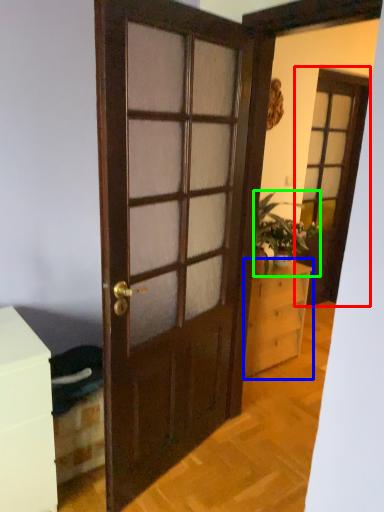
Question: Which is nearer to the screen door (highlighted by a red box)? chest of drawers (highlighted by a blue box) or houseplant (highlighted by a green box).

Choices:
 (A) chest of drawers
 (B) houseplant

Answer: (B)